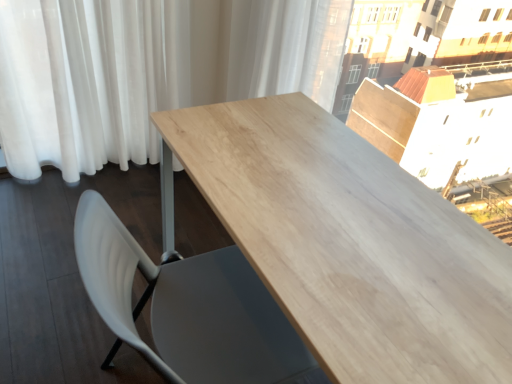
Question: From their relative heights in the image, would you say white plastic chair at lower left is taller or shorter than white sheer curtain at left, which is counted as the 2th curtain, starting from the right?

Choices:
 (A) short
 (B) tall

Answer: (A)

Question: From a real-world perspective, relative to white sheer curtain at left, which is counted as the 2th curtain, starting from the right, is white plastic chair at lower left vertically above or below?

Choices:
 (A) above
 (B) below

Answer: (B)

Question: Which of these objects is positioned closest to the white sheer curtain at left, which is counted as the 2th curtain, starting from the right?

Choices:
 (A) white sheer curtain at upper center, positioned as the 2th curtain in left-to-right order
 (B) light wood table at center
 (C) white plastic chair at lower left

Answer: (A)

Question: Considering the real-world distances, which object is farthest from the white plastic chair at lower left?

Choices:
 (A) white sheer curtain at upper center, arranged as the first curtain when viewed from the right
 (B) white sheer curtain at left, which is counted as the 2th curtain, starting from the right
 (C) light wood table at center

Answer: (B)